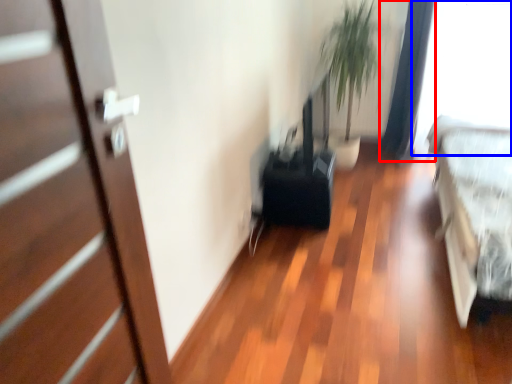
Question: Which object appears farthest to the camera in this image, curtain (highlighted by a red box) or window screen (highlighted by a blue box)?

Choices:
 (A) curtain
 (B) window screen

Answer: (A)